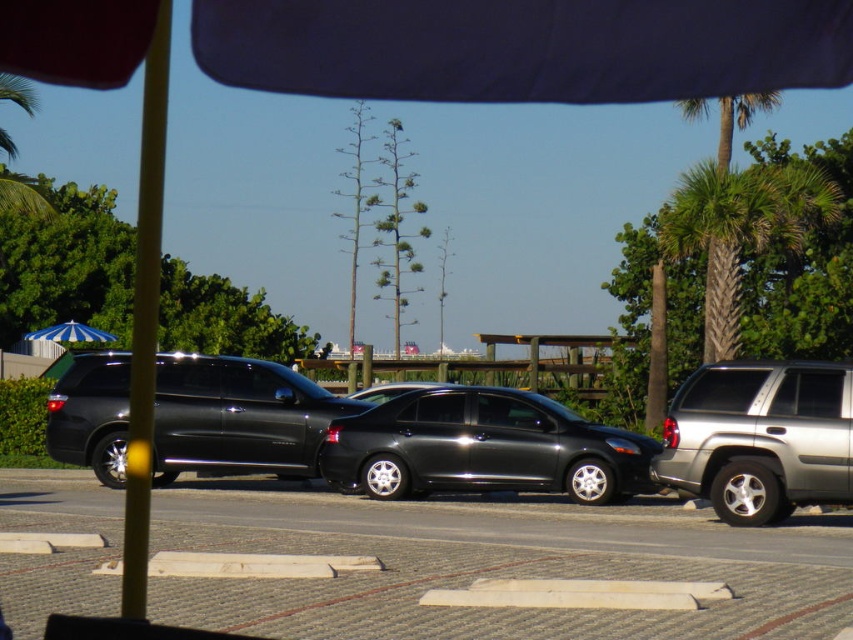
You are standing in the parking lot and want to walk from point A to point B. Point A is at coordinates point (831, 595) and point B is at coordinates point (554, 456). Which point is closer to you when you start walking?

Point (831, 595) is closer to the viewer than point (554, 456), so you will start at the closer point and walk towards the farther one.

You are a delivery person trying to park your van between the silver metallic suv at right and the blue striped umbrella at left. Based on the scene, can you safely park there without blocking the umbrella?

The silver metallic suv at right is in front of the blue striped umbrella at left, meaning the umbrella is behind the SUV. Since the SUV is parked in front of the umbrella, there is no space between them for your van. Therefore, you cannot park between them safely without blocking the umbrella.